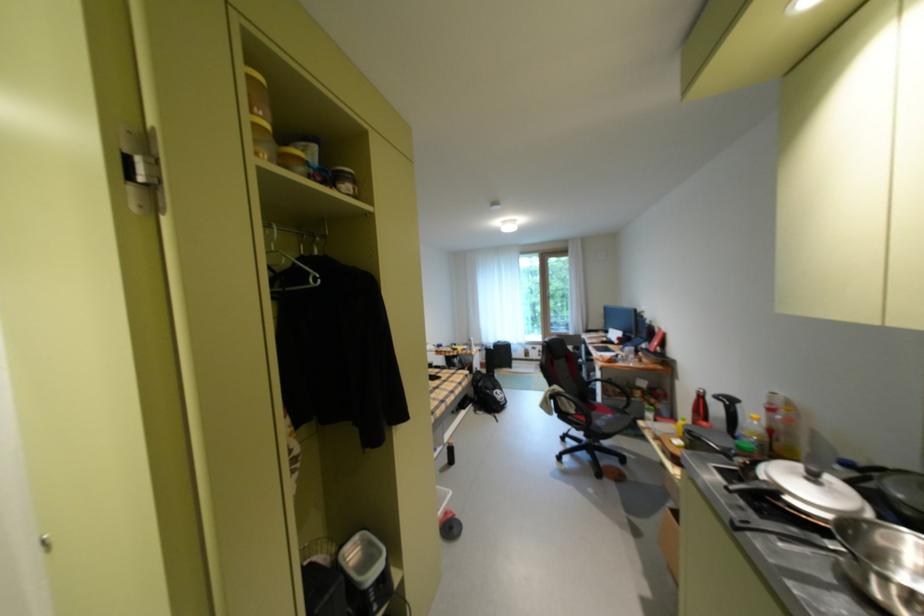
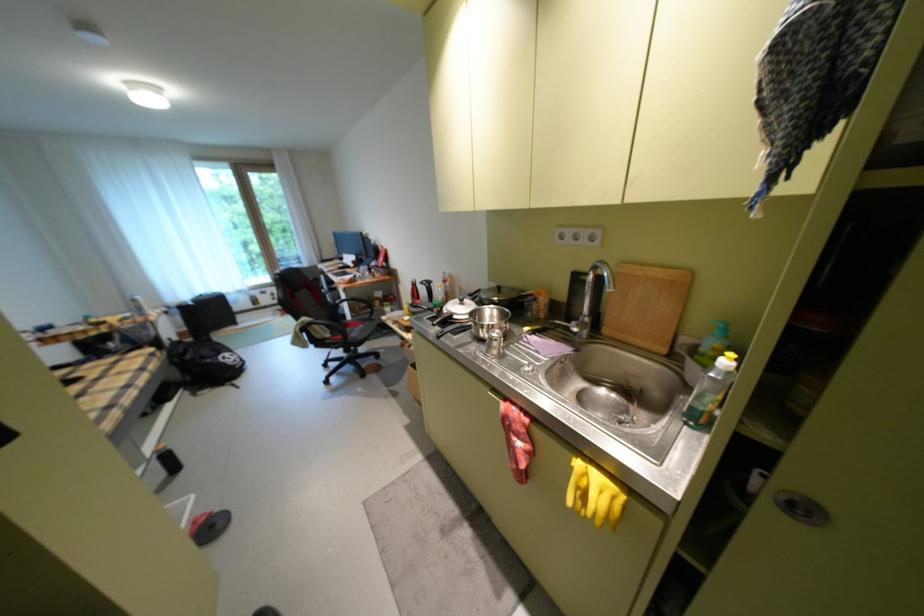
The point at (511, 395) is marked in the first image. Where is the corresponding point in the second image?

(239, 358)